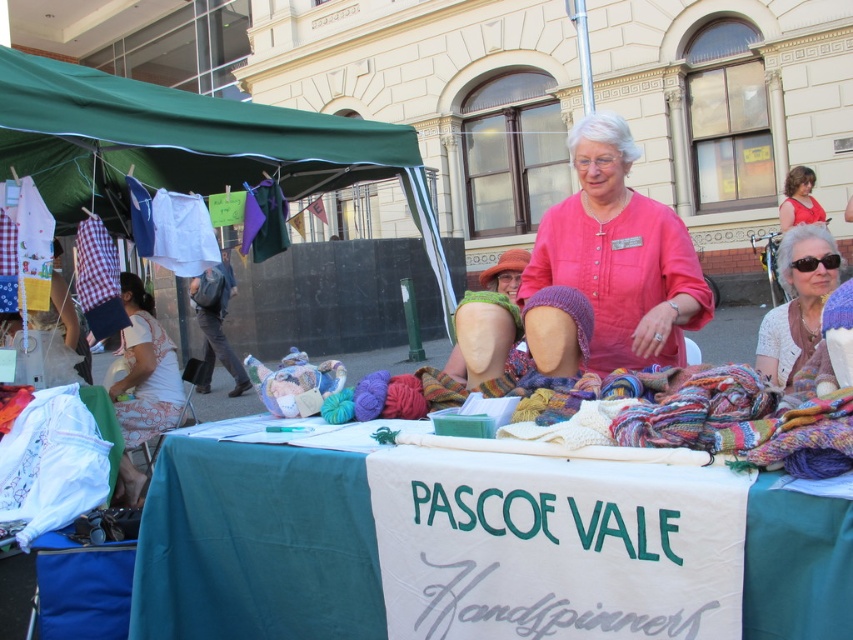
Between white cloth at center and leather bag at center, which one has more height?

leather bag at center

Does white cloth at center have a smaller size compared to leather bag at center?

Correct, white cloth at center occupies less space than leather bag at center.

Measure the distance between point (306, 545) and camera.

Point (306, 545) is 2.50 meters from camera.

At what (x,y) coordinates should I click in order to perform the action: click on white cloth at center. Please return your answer as a coordinate pair (x, y). This screenshot has width=853, height=640. Looking at the image, I should click on (256, 545).

In the scene shown: Can you confirm if white cloth at center is positioned to the left of pink knitted socks at center?

Correct, you'll find white cloth at center to the left of pink knitted socks at center.

Does white cloth at center appear on the right side of pink knitted socks at center?

In fact, white cloth at center is to the left of pink knitted socks at center.

At what (x,y) coordinates should I click in order to perform the action: click on white cloth at center. Please return your answer as a coordinate pair (x, y). The image size is (853, 640). Looking at the image, I should click on (256, 545).

Can you confirm if green fabric canopy at upper left is shorter than white floral dress at lower left?

Yes.

This screenshot has height=640, width=853. What do you see at coordinates (189, 147) in the screenshot?
I see `green fabric canopy at upper left` at bounding box center [189, 147].

Between point (142, 140) and point (122, 384), which one is positioned behind?

Positioned behind is point (122, 384).

At what (x,y) coordinates should I click in order to perform the action: click on green fabric canopy at upper left. Please return your answer as a coordinate pair (x, y). The image size is (853, 640). Looking at the image, I should click on 189,147.